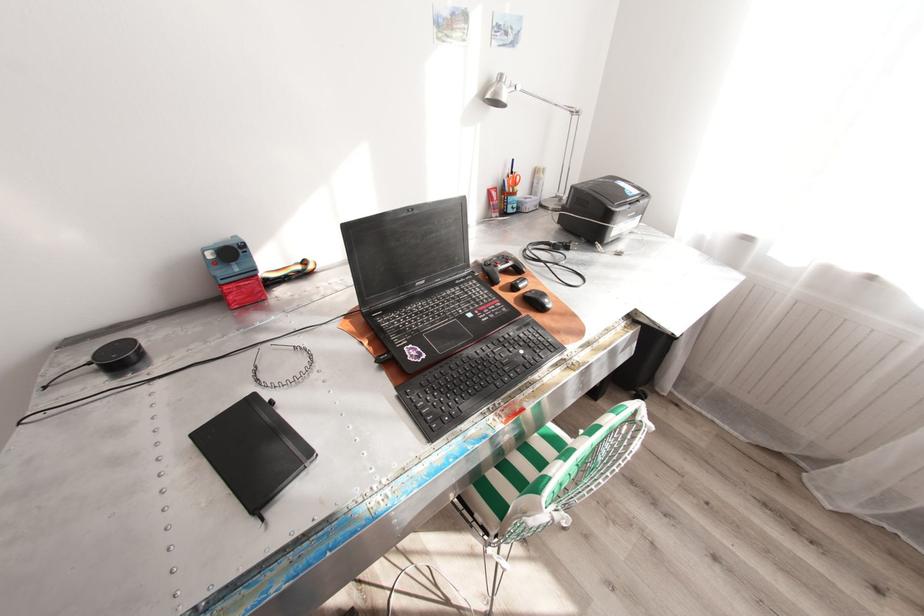
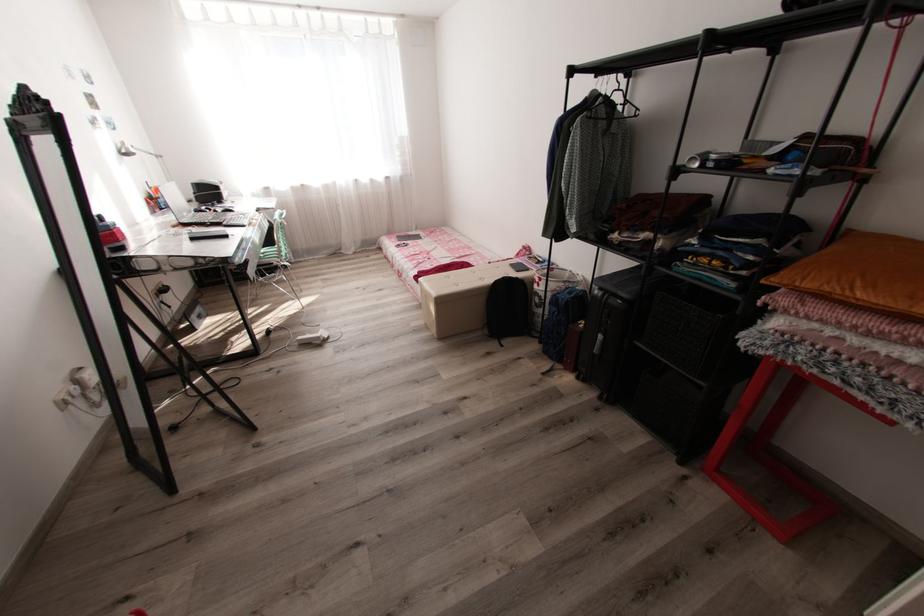
Question: I am providing you with two images of the same scene from different viewpoints. Please identify which objects are invisible in image2.

Choices:
 (A) game controller joystick
 (B) black trash bin handle
 (C) black woven basket
 (D) silver desk lamp

Answer: (A)